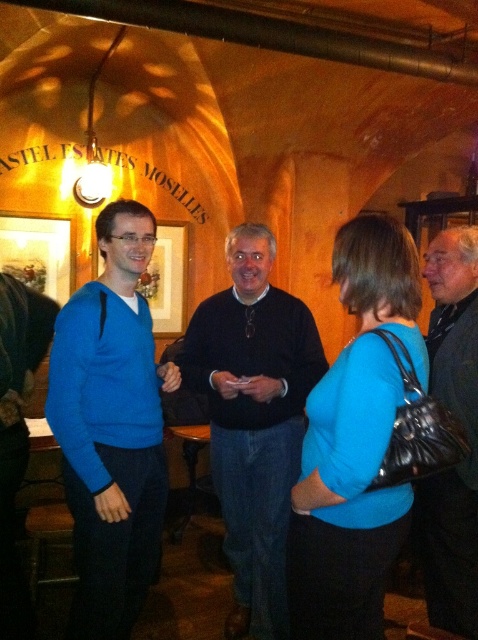
Question: Does matte blue sweater at left appear on the right side of black leather jacket at right?

Choices:
 (A) no
 (B) yes

Answer: (A)

Question: Which object appears farthest from the camera in this image?

Choices:
 (A) dark blue sweater at center
 (B) black leather jacket at right

Answer: (A)

Question: Can you confirm if dark blue sweater at center is positioned to the left of black leather jacket at right?

Choices:
 (A) no
 (B) yes

Answer: (B)

Question: Which object is the farthest from the blue matte shirt at center?

Choices:
 (A) black leather jacket at right
 (B) matte blue sweater at left
 (C) dark blue sweater at center

Answer: (C)

Question: Which of the following is the closest to the observer?

Choices:
 (A) (235, 506)
 (B) (115, 566)

Answer: (B)

Question: Where is matte blue sweater at left located in relation to blue matte shirt at center in the image?

Choices:
 (A) left
 (B) right

Answer: (A)